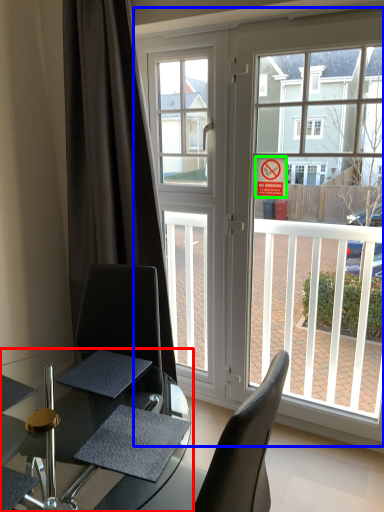
Question: Based on their relative distances, which object is nearer to table (highlighted by a red box)? Choose from window (highlighted by a blue box) and parking sign (highlighted by a green box).

Choices:
 (A) window
 (B) parking sign

Answer: (A)